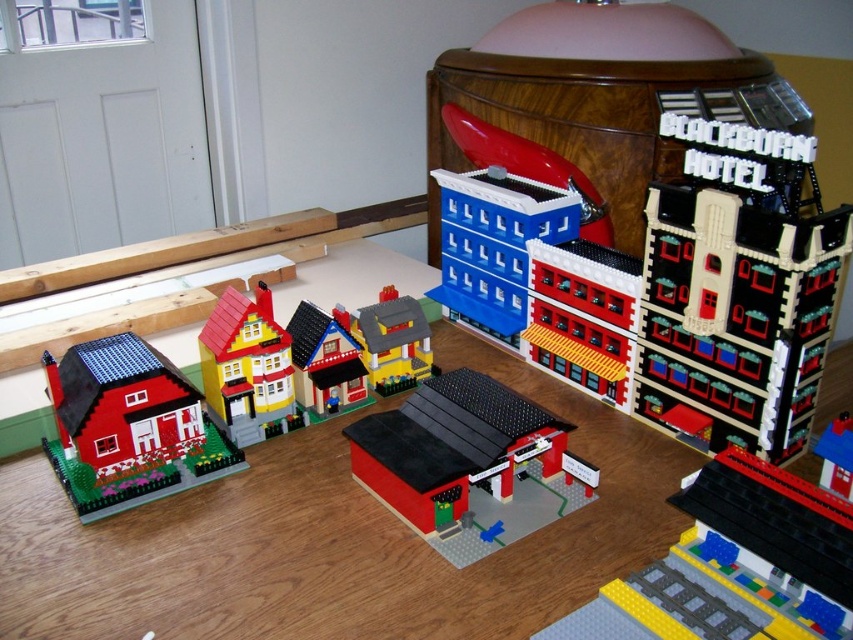
Which of these two, yellow matte road at lower center or smooth red carport at center, stands shorter?

yellow matte road at lower center is shorter.

Which is behind, point (822, 628) or point (389, 432)?

Positioned behind is point (389, 432).

Image resolution: width=853 pixels, height=640 pixels. Identify the location of yellow matte road at lower center. point(747,557).

Does yellow matte house at center-left appear under matte plastic house at center?

Indeed, yellow matte house at center-left is positioned under matte plastic house at center.

Is yellow matte house at center-left to the left of matte plastic house at center from the viewer's perspective?

Correct, you'll find yellow matte house at center-left to the left of matte plastic house at center.

Measure the distance between point (264, 362) and camera.

They are 1.08 meters apart.

Where is `yellow matte house at center-left`? This screenshot has width=853, height=640. yellow matte house at center-left is located at coordinates (247, 369).

Based on the photo, which of these two, yellow matte road at lower center or yellow matte house at center-left, stands shorter?

yellow matte road at lower center

Is point (685, 577) positioned behind point (248, 400)?

No, it is not.

The width and height of the screenshot is (853, 640). Identify the location of yellow matte road at lower center. pyautogui.click(x=747, y=557).